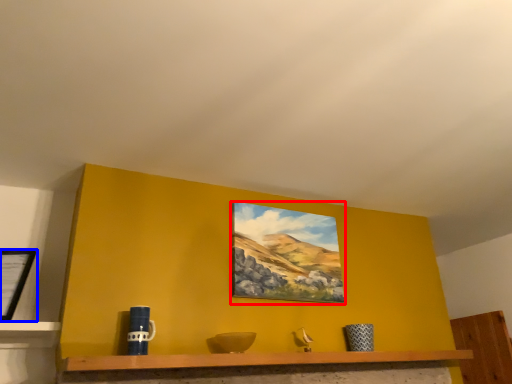
Question: Which point is closer to the camera, picture frame (highlighted by a red box) or picture frame (highlighted by a blue box)?

Choices:
 (A) picture frame
 (B) picture frame

Answer: (B)